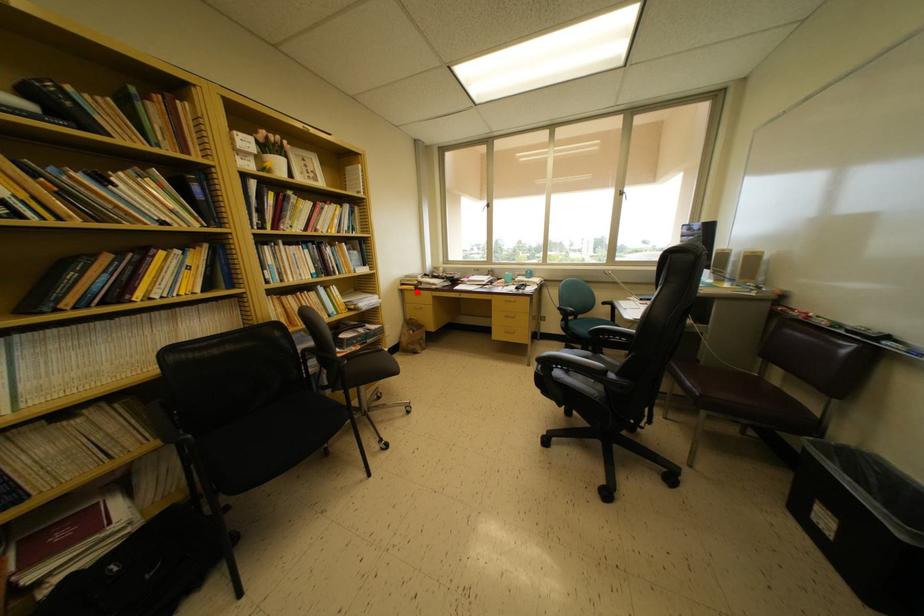
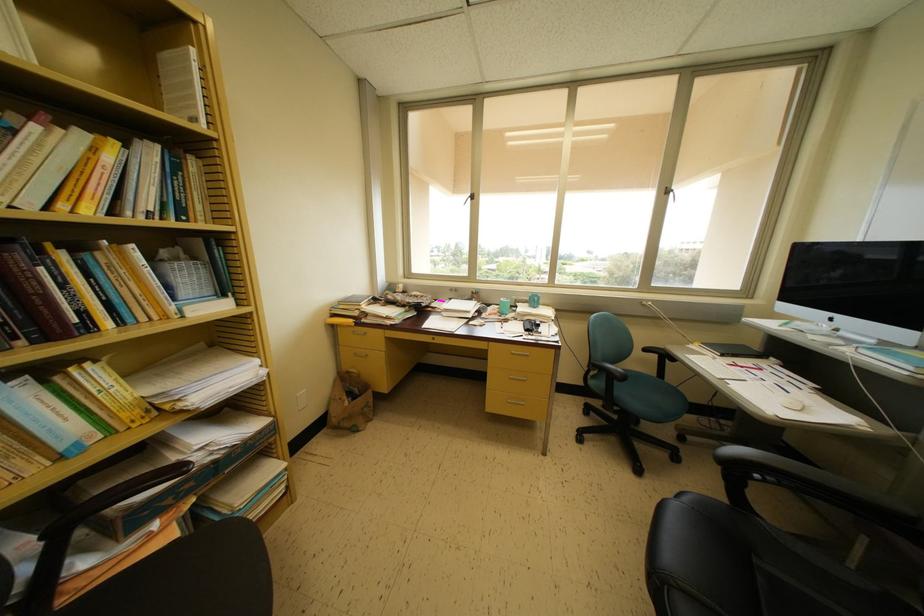
Question: I am providing you with two images of the same scene from different viewpoints. A red point is marked on the first image. At the location where the point appears in image 1, is it still visible in image 2?

Choices:
 (A) Yes
 (B) No

Answer: (A)